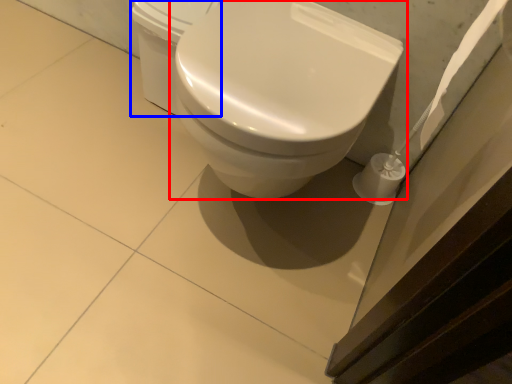
Question: Which object is closer to the camera taking this photo, toilet (highlighted by a red box) or porcelain (highlighted by a blue box)?

Choices:
 (A) toilet
 (B) porcelain

Answer: (A)